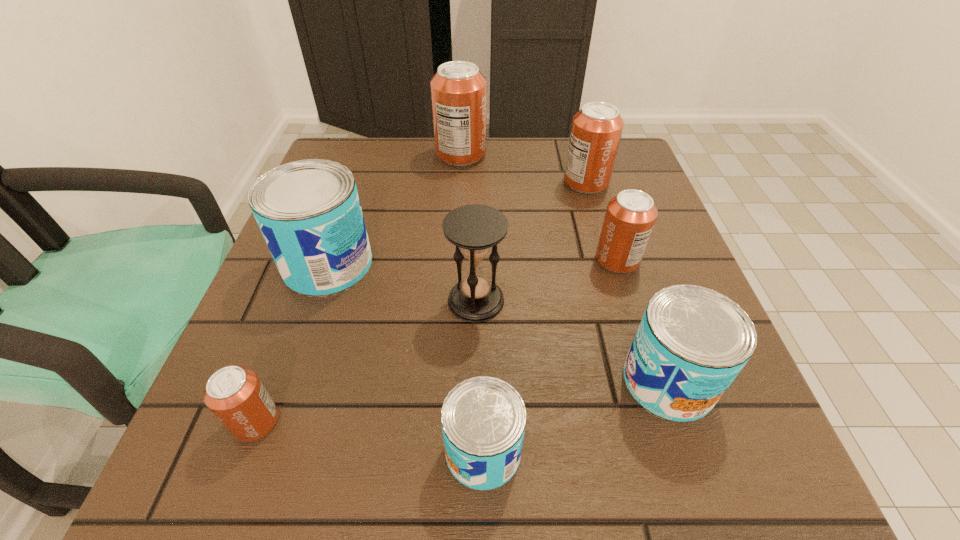
Locate an element on the screen. This screenshot has height=540, width=960. the third closest blue can to the sixth nearest can is located at coordinates (483, 419).

Find the location of a particular element. the closest blue can to the smallest orange can is located at coordinates (309, 212).